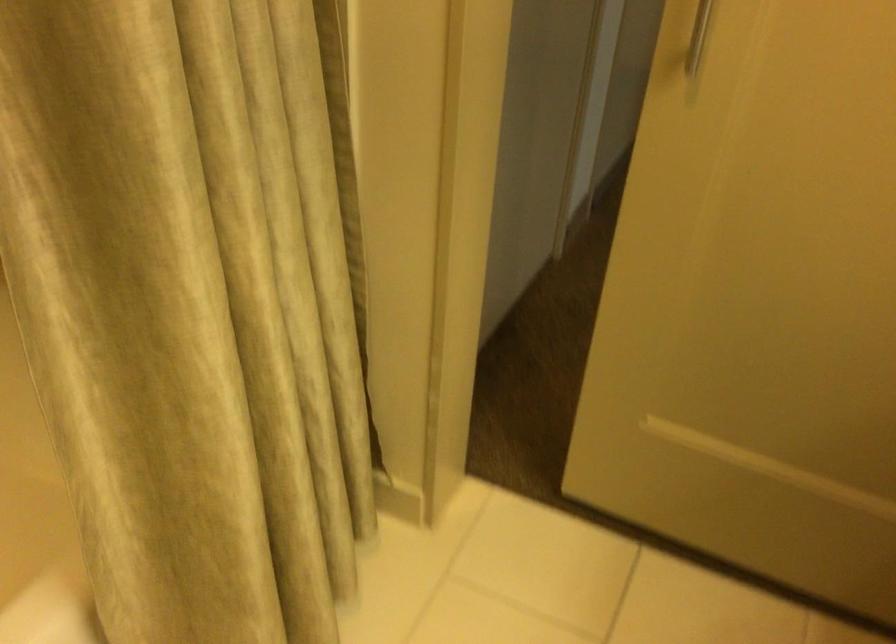
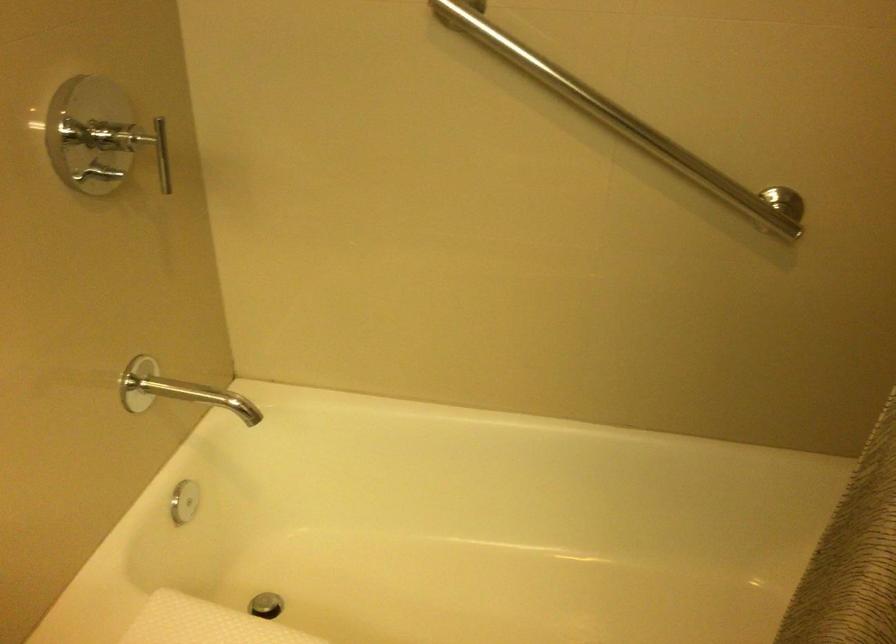
Question: The camera is either moving clockwise (left) or counter-clockwise (right) around the object. The first image is from the beginning of the video and the second image is from the end. Is the camera moving left or right when shooting the video?

Choices:
 (A) Left
 (B) Right

Answer: (B)